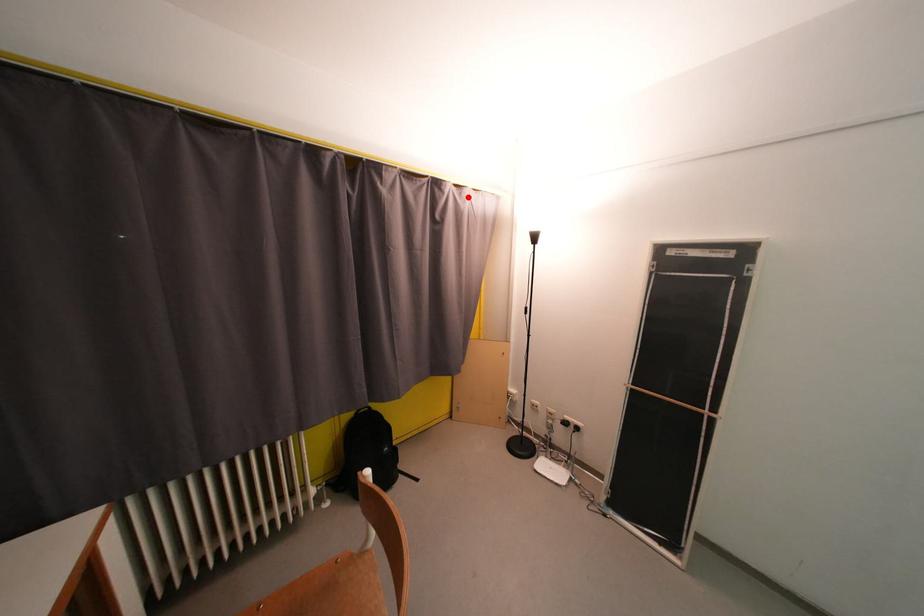
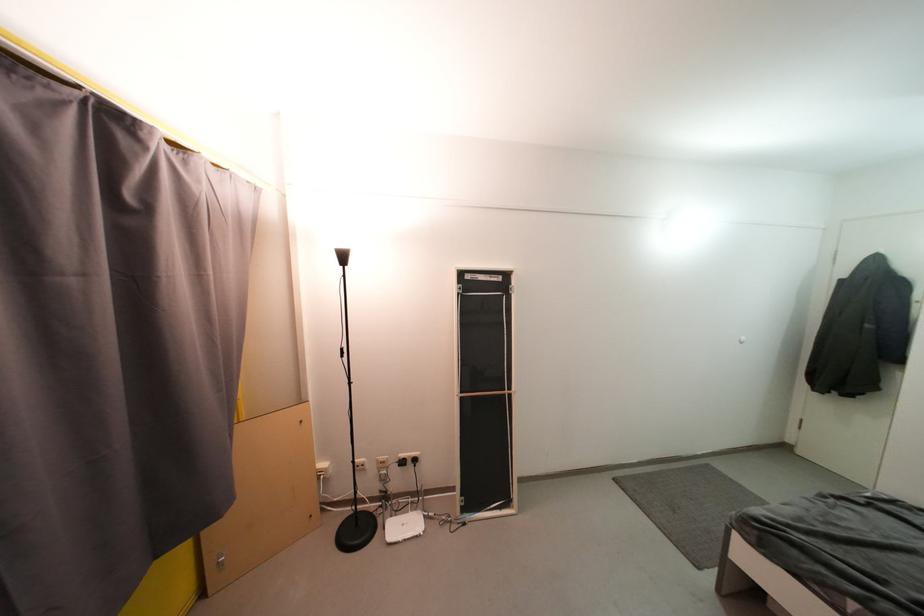
The point at the highlighted location is marked in the first image. Where is the corresponding point in the second image?

(192, 166)